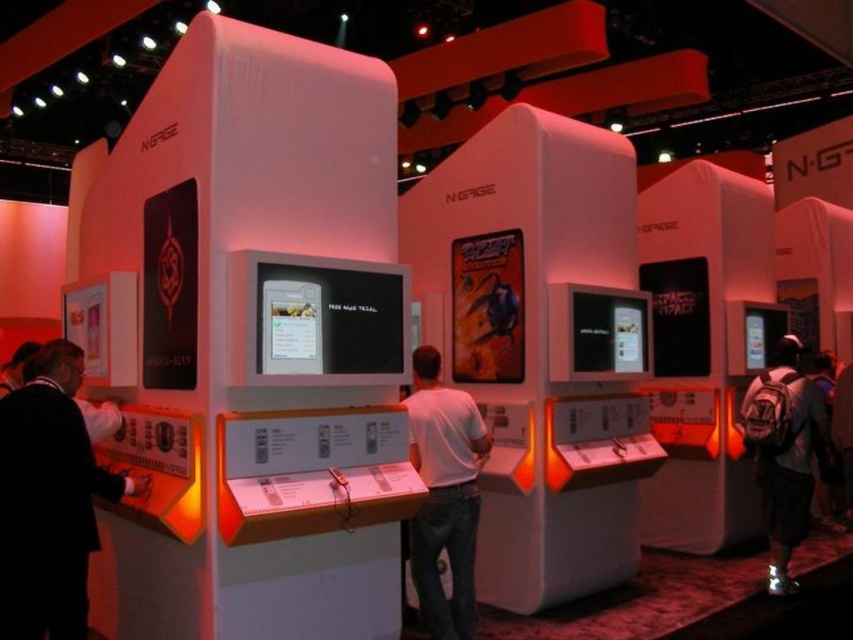
Question: Which point appears closest to the camera in this image?

Choices:
 (A) (780, 595)
 (B) (408, 417)
 (C) (77, 387)

Answer: (C)

Question: Which point is farther to the camera?

Choices:
 (A) (448, 406)
 (B) (821, 445)

Answer: (B)

Question: Is the position of black matte suit at left more distant than that of white matte shirt at center?

Choices:
 (A) no
 (B) yes

Answer: (A)

Question: Observing the image, what is the correct spatial positioning of black matte suit at left in reference to white matte shirt at center?

Choices:
 (A) left
 (B) right

Answer: (A)

Question: Which of the following is the farthest from the observer?

Choices:
 (A) (440, 620)
 (B) (787, 372)
 (C) (57, 588)

Answer: (B)

Question: Does black matte suit at left have a larger size compared to white matte shirt at center?

Choices:
 (A) yes
 (B) no

Answer: (A)